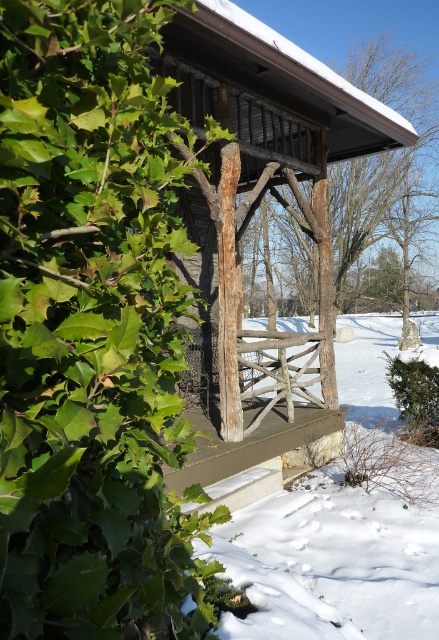
Question: Which object is closer to the camera taking this photo?

Choices:
 (A) smooth brown tree trunk at center
 (B) green leafy bush at lower right
 (C) white wooden fence at lower center

Answer: (A)

Question: Which point is farther to the camera?

Choices:
 (A) rustic wooden fence post at center
 (B) rustic wooden porch at center
 (C) white wooden fence at lower center

Answer: (A)

Question: Considering the relative positions of smooth brown tree trunk at center and rustic wooden porch at center in the image provided, where is smooth brown tree trunk at center located with respect to rustic wooden porch at center?

Choices:
 (A) above
 (B) below

Answer: (A)

Question: From the image, what is the correct spatial relationship of rustic wooden fence post at center in relation to rustic wooden porch at center?

Choices:
 (A) above
 (B) below

Answer: (A)

Question: Based on their relative distances, which object is nearer to the smooth brown tree trunk at center?

Choices:
 (A) green leafy bush at lower right
 (B) rustic wooden fence post at center

Answer: (A)

Question: Where is white wooden fence at lower center located in relation to rustic wooden fence post at center in the image?

Choices:
 (A) below
 (B) above

Answer: (A)